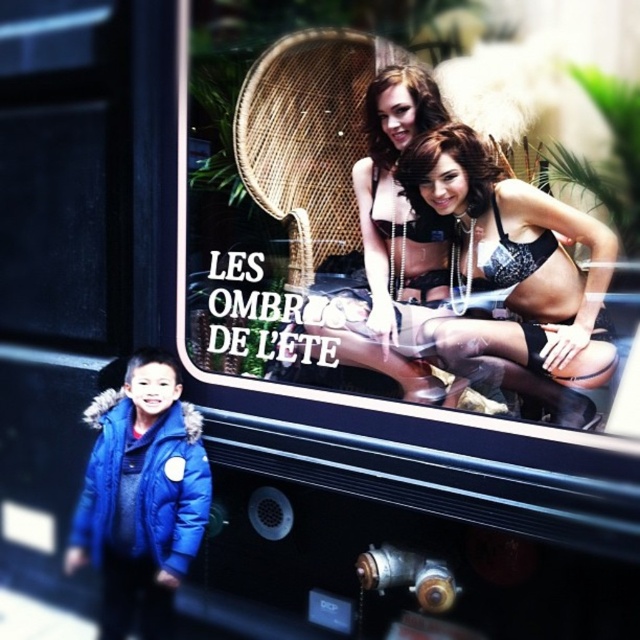
Where is the satin black lingerie at center positioned in the image?

The satin black lingerie at center is positioned at coordinates point [515,259].

You are a fashion designer observing the storefront window display. You need to determine the spatial relationship between the satin black lingerie at center and the shiny brown hair at upper center. Which object is positioned closer to the observer?

The satin black lingerie at center is closer to the observer than the shiny brown hair at upper center.